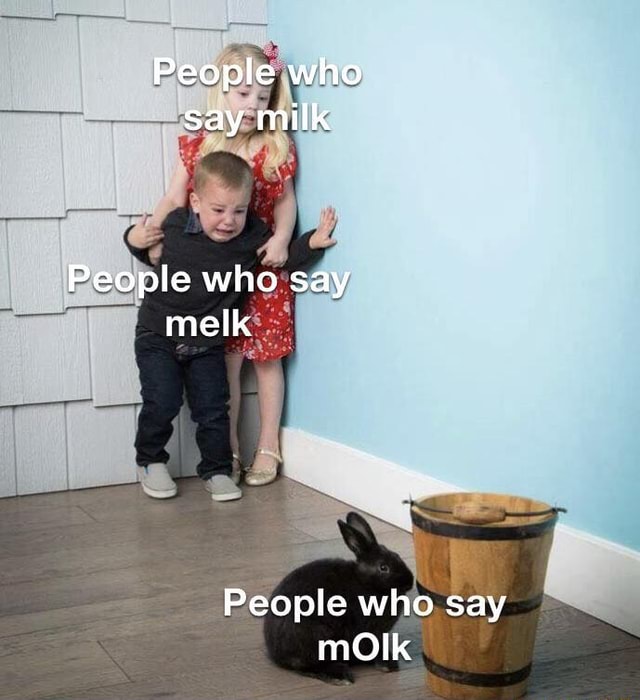
At what (x,y) coordinates should I click in order to perform the action: click on light blue wall. Please return your answer as a coordinate pair (x, y). This screenshot has width=640, height=700. Looking at the image, I should click on (511, 372).